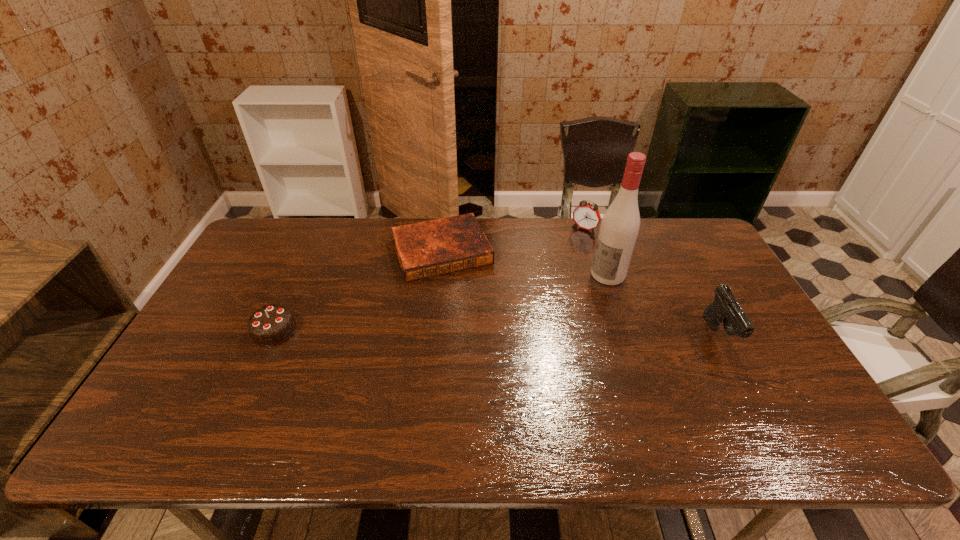
This screenshot has height=540, width=960. Find the location of `free point between the alarm clock and the pistol`. free point between the alarm clock and the pistol is located at coordinates (652, 282).

At what (x,y) coordinates should I click in order to perform the action: click on free point between the shortest object and the alarm clock. Please return your answer as a coordinate pair (x, y). The height and width of the screenshot is (540, 960). Looking at the image, I should click on pyautogui.click(x=513, y=240).

Locate an element on the screen. Image resolution: width=960 pixels, height=540 pixels. vacant region between the alarm clock and the leftmost object is located at coordinates (429, 280).

Locate an element on the screen. The width and height of the screenshot is (960, 540). free space between the fourth object from right to left and the alarm clock is located at coordinates (513, 240).

I want to click on vacant space in between the pistol and the tallest object, so click(663, 305).

This screenshot has width=960, height=540. Identify the location of free point between the rightmost object and the shortest object. (580, 293).

This screenshot has width=960, height=540. What are the coordinates of `free space between the chocolate cake and the alarm clock` in the screenshot? It's located at (429, 280).

Locate an element on the screen. This screenshot has width=960, height=540. object that ranks as the fourth closest to the alarm clock is located at coordinates (271, 325).

In order to click on object that is the third nearest to the rightmost object in this screenshot , I will do `click(436, 247)`.